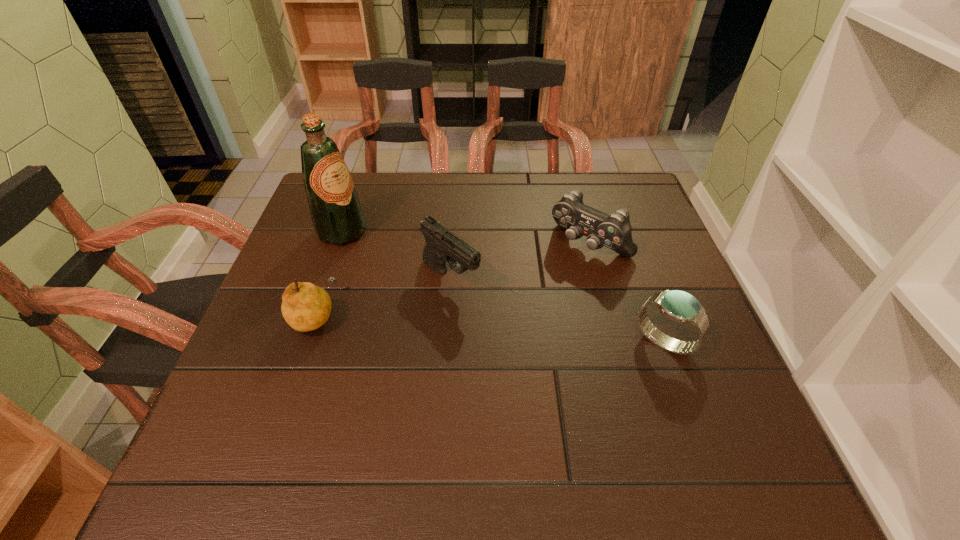
Where is `control that is at the right edge`? control that is at the right edge is located at coordinates (614, 231).

You are a GUI agent. You are given a task and a screenshot of the screen. Output one action in this format:
    pyautogui.click(x=<x>, y=<y>)
    Task: Click on the object present at the far left corner
    
    Given the screenshot: What is the action you would take?
    pyautogui.click(x=337, y=216)

Identify the location of vacant space at the far edge of the desktop. (527, 177).

This screenshot has height=540, width=960. In order to click on free region at the near edge of the desktop in this screenshot , I will do [x=549, y=402].

Identify the location of free spot at the right edge of the desktop. tap(639, 251).

This screenshot has width=960, height=540. In the image, there is a desktop. What are the coordinates of `vacant area at the far left corner` in the screenshot? It's located at (369, 199).

Where is `free space at the far right corner of the desktop`? The width and height of the screenshot is (960, 540). free space at the far right corner of the desktop is located at coordinates (603, 208).

The height and width of the screenshot is (540, 960). Find the location of `vacant point at the near right corner`. vacant point at the near right corner is located at coordinates (670, 394).

The height and width of the screenshot is (540, 960). What are the coordinates of `empty space that is in between the olive oil and the control` in the screenshot? It's located at (466, 238).

You are a GUI agent. You are given a task and a screenshot of the screen. Output one action in this format:
    pyautogui.click(x=<x>, y=<y>)
    Task: Click on the blank region between the third object from left to right and the tallest object
    This screenshot has height=540, width=960.
    Given the screenshot: What is the action you would take?
    pyautogui.click(x=396, y=255)